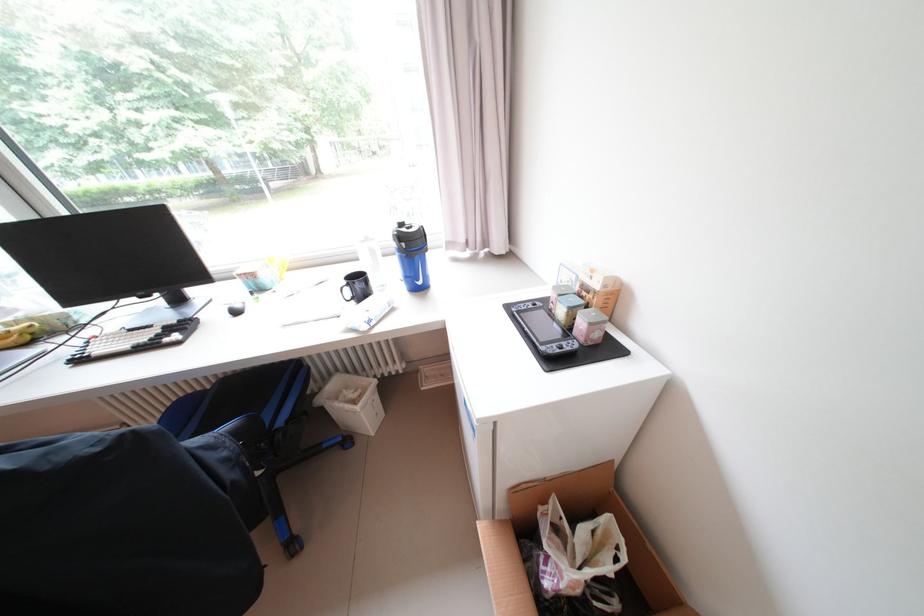
Where would you lift the blue bottle handle? Please return your answer as a coordinate pair (x, y).

(398, 249)